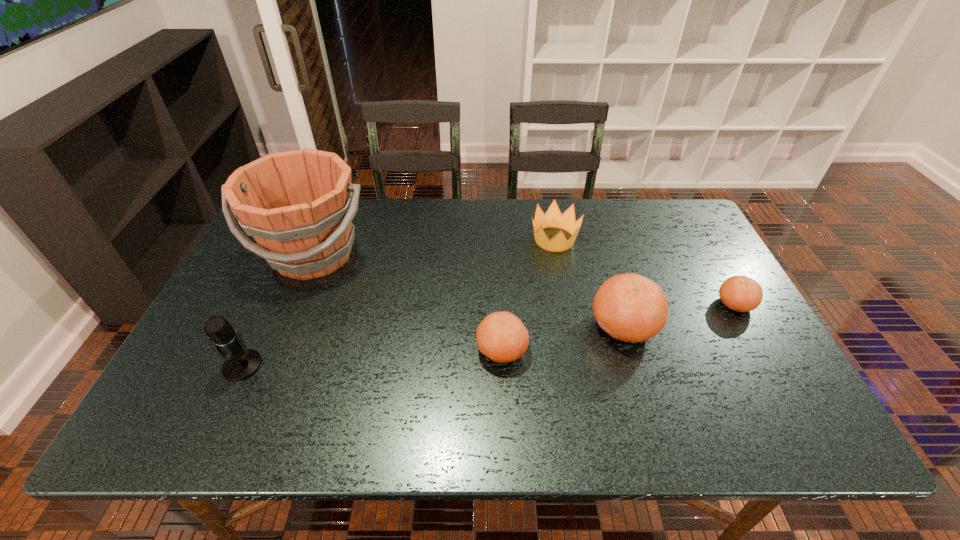
Please point a vacant point for placing a clementine on the left. Please provide its 2D coordinates. Your answer should be formatted as a tuple, i.e. [(x, y)], where the tuple contains the x and y coordinates of a point satisfying the conditions above.

[(367, 376)]